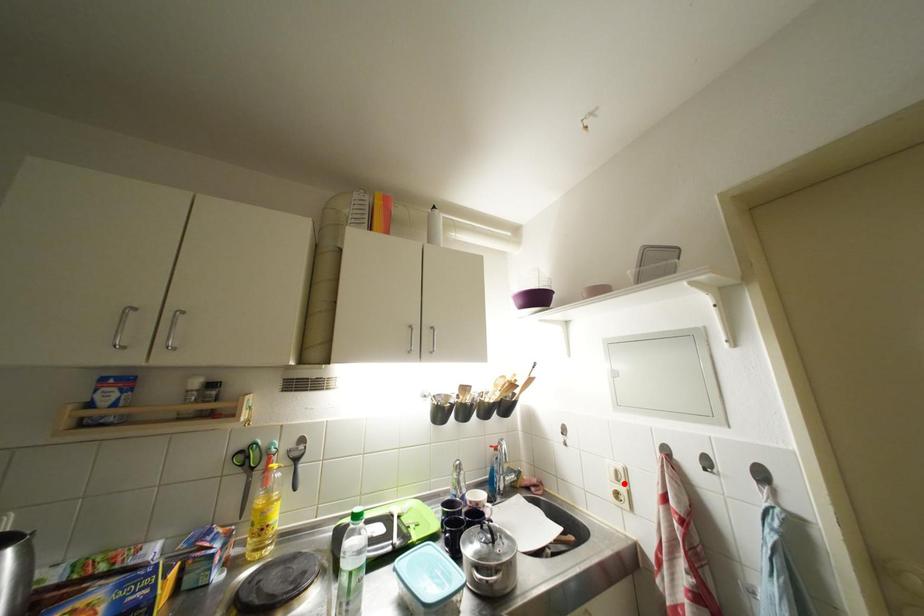
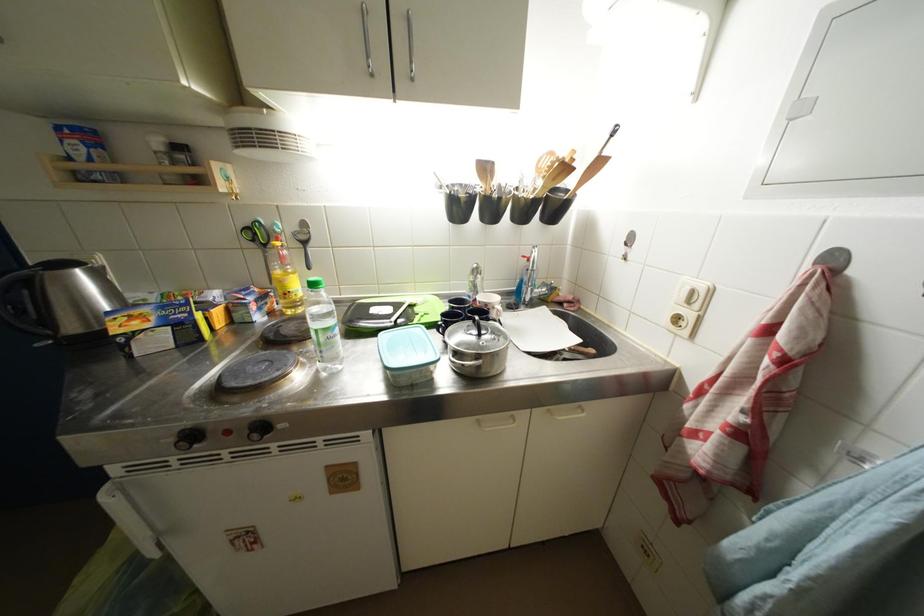
Locate, in the second image, the point that corresponds to the highlighted location in the first image.

(696, 306)